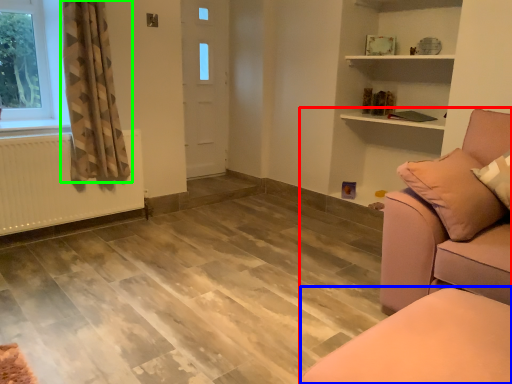
Question: Which is nearer to the studio couch (highlighted by a red box)? furniture (highlighted by a blue box) or curtain (highlighted by a green box).

Choices:
 (A) furniture
 (B) curtain

Answer: (A)